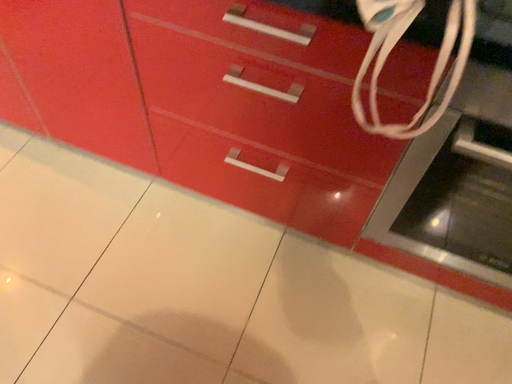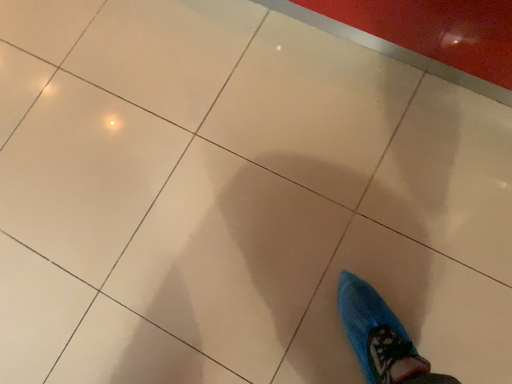
Question: Which way did the camera rotate in the video?

Choices:
 (A) rotated left
 (B) rotated right

Answer: (A)